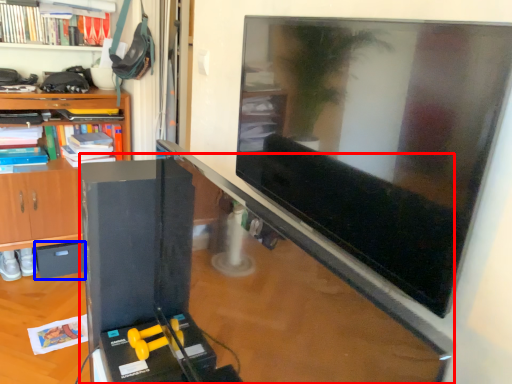
Question: Which of the following is the closest to the observer, computer desk (highlighted by a red box) or drawer (highlighted by a blue box)?

Choices:
 (A) computer desk
 (B) drawer

Answer: (A)